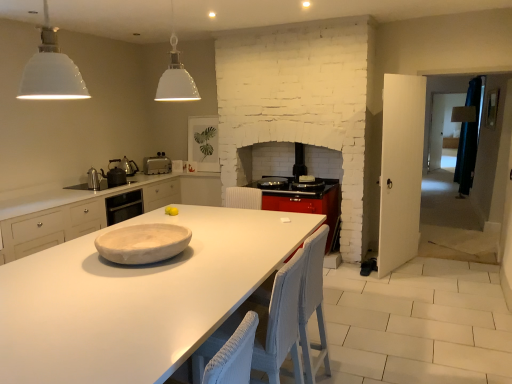
Image resolution: width=512 pixels, height=384 pixels. What do you see at coordinates (94, 179) in the screenshot?
I see `metallic silver kettle at left, positioned as the first appliance in front-to-back order` at bounding box center [94, 179].

Image resolution: width=512 pixels, height=384 pixels. What do you see at coordinates (129, 166) in the screenshot? I see `metallic silver kettle at left, acting as the third appliance starting from the front` at bounding box center [129, 166].

Describe the element at coordinates (313, 304) in the screenshot. The height and width of the screenshot is (384, 512). I see `white woven chair at center, placed as the second chair when sorted from front to back` at that location.

What do you see at coordinates (157, 164) in the screenshot? The width and height of the screenshot is (512, 384). I see `silver metallic toaster at center, the fourth appliance from the front` at bounding box center [157, 164].

Identify the location of metallic silver kettle at left, which is the fourth appliance from back to front. (94, 179).

Could you tell me if white matte pendant light at upper left, the first light fixture positioned from the left, is turned towards metallic silver kettle at left, positioned as the first appliance in front-to-back order?

No, white matte pendant light at upper left, the first light fixture positioned from the left, is not turned towards metallic silver kettle at left, positioned as the first appliance in front-to-back order.

Based on the photo, is white matte pendant light at upper left, acting as the 2th light fixture starting from the right, thinner than metallic silver kettle at left, positioned as the first appliance in front-to-back order?

Incorrect, the width of white matte pendant light at upper left, acting as the 2th light fixture starting from the right, is not less than that of metallic silver kettle at left, positioned as the first appliance in front-to-back order.

Considering the sizes of objects white matte pendant light at upper left, acting as the first light fixture starting from the front, and metallic silver kettle at left, which is the fourth appliance from back to front, in the image provided, who is smaller, white matte pendant light at upper left, acting as the first light fixture starting from the front, or metallic silver kettle at left, which is the fourth appliance from back to front,?

With smaller size is metallic silver kettle at left, which is the fourth appliance from back to front.

Is point (95, 187) closer or farther from the camera than point (296, 297)?

Point (95, 187).

From the image's perspective, is metallic silver kettle at left, which is the fourth appliance from back to front, on white wicker chair at center, the first chair from the front?

Yes, from the image's perspective, metallic silver kettle at left, which is the fourth appliance from back to front, is on top of white wicker chair at center, the first chair from the front.

Which is behind, metallic silver kettle at left, which is the fourth appliance from back to front, or white wicker chair at center, acting as the second chair starting from the back?

Positioned behind is metallic silver kettle at left, which is the fourth appliance from back to front.

Can you confirm if silver metallic toaster at center, the fourth appliance from the front, is thinner than white matte pendant light at upper left, which is the second light fixture from back to front?

Yes, silver metallic toaster at center, the fourth appliance from the front, is thinner than white matte pendant light at upper left, which is the second light fixture from back to front.

Can you confirm if silver metallic toaster at center, the fourth appliance from the front, is bigger than white matte pendant light at upper left, acting as the 2th light fixture starting from the right?

No, silver metallic toaster at center, the fourth appliance from the front, is not bigger than white matte pendant light at upper left, acting as the 2th light fixture starting from the right.

From the image's perspective, which one is positioned lower, silver metallic toaster at center, the first appliance when ordered from back to front, or white matte pendant light at upper left, acting as the 2th light fixture starting from the right?

silver metallic toaster at center, the first appliance when ordered from back to front.

What's the angular difference between silver metallic toaster at center, the first appliance when ordered from back to front, and white matte pendant light at upper left, the first light fixture positioned from the left,'s facing directions?

There is a 124-degree angle between the facing directions of silver metallic toaster at center, the first appliance when ordered from back to front, and white matte pendant light at upper left, the first light fixture positioned from the left.

Considering the relative sizes of white marble platter at center and white matte countertop at center in the image provided, is white marble platter at center shorter than white matte countertop at center?

Yes, white marble platter at center is shorter than white matte countertop at center.

Considering the sizes of objects white marble platter at center and white matte countertop at center in the image provided, who is bigger, white marble platter at center or white matte countertop at center?

white matte countertop at center is bigger.

Is white matte countertop at center a part of white marble platter at center?

That's incorrect, white matte countertop at center is not inside white marble platter at center.

Is white marble platter at center to the right of white matte countertop at center from the viewer's perspective?

Incorrect, white marble platter at center is not on the right side of white matte countertop at center.

There is a metallic silver kettle at left, acting as the third appliance starting from the front. What are the coordinates of `the 2nd light fixture above it (from the image's perspective)` in the screenshot? It's located at (176, 76).

From a real-world perspective, is white matte pendant light at upper center, which ranks as the first light fixture in right-to-left order, over metallic silver kettle at left, acting as the third appliance starting from the front?

Yes.

Is white matte pendant light at upper center, acting as the second light fixture starting from the front, far away from metallic silver kettle at left, acting as the third appliance starting from the front?

Yes, white matte pendant light at upper center, acting as the second light fixture starting from the front, is far from metallic silver kettle at left, acting as the third appliance starting from the front.

Which object is closer to the camera, white matte pendant light at upper center, the first light fixture viewed from the back, or metallic silver kettle at left, acting as the third appliance starting from the front?

Positioned in front is white matte pendant light at upper center, the first light fixture viewed from the back.

From a real-world perspective, is metallic silver kettle at left, which is the 2th appliance from back to front, on top of white wicker chair at center, the first chair from the front?

Indeed, from a real-world perspective, metallic silver kettle at left, which is the 2th appliance from back to front, stands above white wicker chair at center, the first chair from the front.

Is point (131, 166) positioned in front of point (290, 301)?

No, it is behind (290, 301).

Where is `the 2nd chair below the metallic silver kettle at left, acting as the third appliance starting from the front (from the image's perspective)`? This screenshot has height=384, width=512. the 2nd chair below the metallic silver kettle at left, acting as the third appliance starting from the front (from the image's perspective) is located at coordinates (265, 326).

Is white woven chair at center, placed as the second chair when sorted from front to back, taller or shorter than white wicker chair at center, the first chair from the front?

A: In the image, white woven chair at center, placed as the second chair when sorted from front to back, appears to be taller than white wicker chair at center, the first chair from the front.

Is white woven chair at center, placed as the second chair when sorted from front to back, thinner than white wicker chair at center, acting as the second chair starting from the back?

Indeed, white woven chair at center, placed as the second chair when sorted from front to back, has a lesser width compared to white wicker chair at center, acting as the second chair starting from the back.

Is white wicker chair at center, acting as the second chair starting from the back, inside white woven chair at center, placed as the first chair when sorted from back to front?

No, white wicker chair at center, acting as the second chair starting from the back, is not inside white woven chair at center, placed as the first chair when sorted from back to front.

From the image's perspective, is white woven chair at center, placed as the second chair when sorted from front to back, under white wicker chair at center, acting as the second chair starting from the back?

Actually, white woven chair at center, placed as the second chair when sorted from front to back, appears above white wicker chair at center, acting as the second chair starting from the back, in the image.

From the metallic silver kettle at left, positioned as the first appliance in front-to-back order, count 1st light fixture to the right and point to it. Please provide its 2D coordinates.

[(51, 71)]

Locate an element on the screen. The width and height of the screenshot is (512, 384). appliance that is the 2nd object above the white wicker chair at center, the first chair from the front (from a real-world perspective) is located at coordinates (94, 179).

Based on their spatial positions, is white marble platter at center or white wicker chair at center, acting as the second chair starting from the back, closer to silver metallic toaster at center, the first appliance when ordered from back to front?

The object closer to silver metallic toaster at center, the first appliance when ordered from back to front, is white marble platter at center.

Which object lies nearer to the anchor point white matte pendant light at upper center, the 2th light fixture when ordered from left to right, white wicker chair at center, acting as the second chair starting from the back, or white matte pendant light at upper left, the first light fixture positioned from the left?

white matte pendant light at upper left, the first light fixture positioned from the left, lies closer to white matte pendant light at upper center, the 2th light fixture when ordered from left to right, than the other object.

Which object lies nearer to the anchor point metallic silver kettle at left, positioned as the first appliance in front-to-back order, white woven chair at center, placed as the second chair when sorted from front to back, or matte black kettle at left, placed as the 2th appliance when sorted from front to back?

Based on the image, matte black kettle at left, placed as the 2th appliance when sorted from front to back, appears to be nearer to metallic silver kettle at left, positioned as the first appliance in front-to-back order.

Looking at the image, which one is located further to white matte countertop at center, white wicker chair at center, acting as the second chair starting from the back, or white matte pendant light at upper center, the first light fixture viewed from the back?

white matte pendant light at upper center, the first light fixture viewed from the back, is further to white matte countertop at center.

When comparing their distances from white matte pendant light at upper left, the first light fixture positioned from the left, does metallic silver kettle at left, which is the fourth appliance from back to front, or matte black kettle at left, placed as the 2th appliance when sorted from front to back, seem further?

Based on the image, metallic silver kettle at left, which is the fourth appliance from back to front, appears to be further to white matte pendant light at upper left, the first light fixture positioned from the left.

Looking at the image, which one is located further to white marble platter at center, silver metallic toaster at center, the fourth appliance from the front, or white matte pendant light at upper left, the first light fixture positioned from the left?

The object further to white marble platter at center is silver metallic toaster at center, the fourth appliance from the front.

From the image, which object appears to be nearer to metallic silver kettle at left, which is the fourth appliance from back to front, matte black kettle at left, placed as the 2th appliance when sorted from front to back, or metallic silver kettle at left, acting as the third appliance starting from the front?

matte black kettle at left, placed as the 2th appliance when sorted from front to back, is positioned closer to the anchor metallic silver kettle at left, which is the fourth appliance from back to front.

In the scene shown: From the image, which object appears to be farther from metallic silver kettle at left, which is the fourth appliance from back to front, white marble platter at center or metallic silver kettle at left, which is the 2th appliance from back to front?

Based on the image, white marble platter at center appears to be further to metallic silver kettle at left, which is the fourth appliance from back to front.

Where is `light fixture between white matte pendant light at upper left, which is the second light fixture from back to front, and metallic silver kettle at left, which is the fourth appliance from back to front, in the front-back direction`? Image resolution: width=512 pixels, height=384 pixels. light fixture between white matte pendant light at upper left, which is the second light fixture from back to front, and metallic silver kettle at left, which is the fourth appliance from back to front, in the front-back direction is located at coordinates (176, 76).

The image size is (512, 384). In order to click on chair between white marble platter at center and metallic silver kettle at left, acting as the third appliance starting from the front, in the front-back direction in this screenshot , I will do `click(313, 304)`.

You are a GUI agent. You are given a task and a screenshot of the screen. Output one action in this format:
    pyautogui.click(x=<x>, y=<y>)
    Task: Click on the platter located between white matte pendant light at upper left, acting as the 2th light fixture starting from the right, and metallic silver kettle at left, which is the fourth appliance from back to front, in the depth direction
    Image resolution: width=512 pixels, height=384 pixels.
    Given the screenshot: What is the action you would take?
    pyautogui.click(x=143, y=243)

Where is `light fixture between white matte pendant light at upper center, which ranks as the first light fixture in right-to-left order, and white wicker chair at center, the first chair from the front, vertically`? light fixture between white matte pendant light at upper center, which ranks as the first light fixture in right-to-left order, and white wicker chair at center, the first chair from the front, vertically is located at coordinates (51, 71).